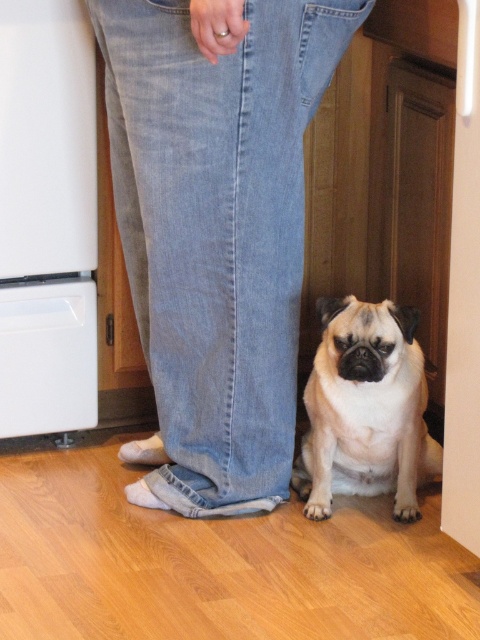
You are standing in the kitchen and want to place a small plant between the two points, point (236,259) and point (320,342). Which point should the plant be closer to if you want it to be nearer to the pug dog?

The plant should be placed closer to point (236,259) because it is closer to the viewer than point (320,342). Since the pug dog is near the bottom of the frame, placing the plant closer to the nearer point would position it closer to the dog.

You are a delivery robot entering a kitchen and see the light blue denim jeans at lower center and the white fur dog at lower center. Which object is closer to the floor?

The white fur dog at lower center is closer to the floor because the light blue denim jeans at lower center is positioned over it.

You are a delivery robot that needs to navigate through a kitchen. You see the light blue denim jeans at lower center and the white fur dog at lower center. Can you pass between them without touching either?

The light blue denim jeans at lower center and the white fur dog at lower right are 14.42 inches apart. Since the robot is likely narrower than 14.42 inches, it should be able to pass between them without touching either.